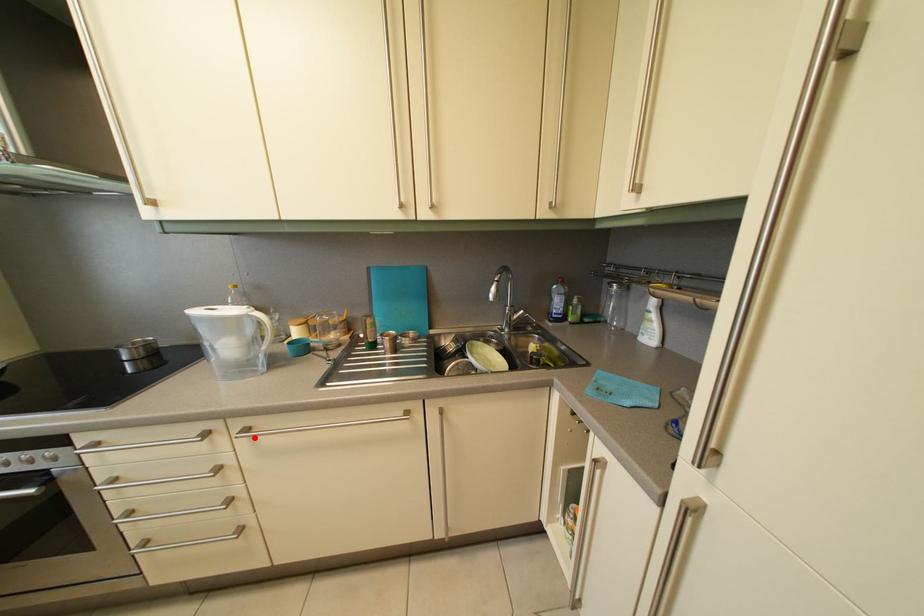
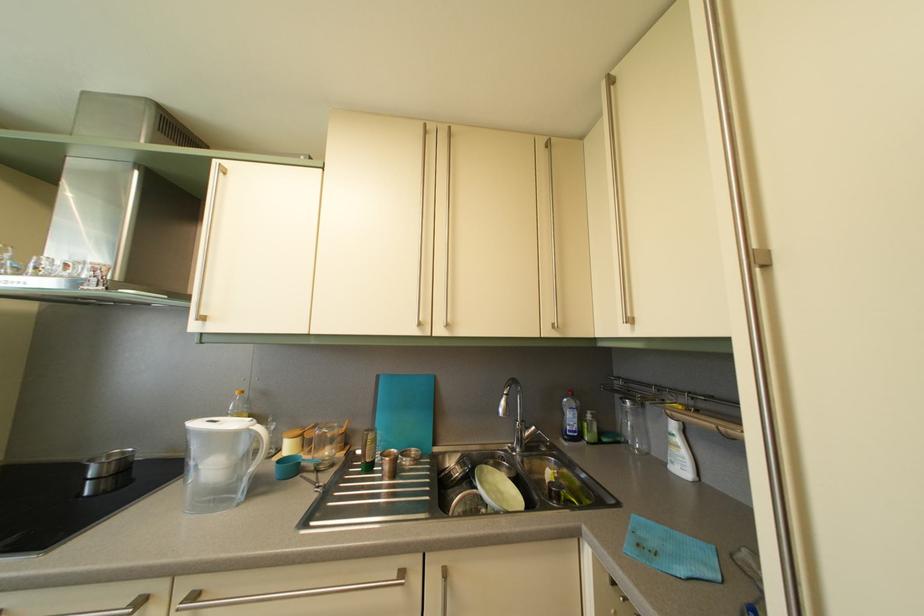
Locate, in the second image, the point that corresponds to the highlighted location in the first image.

(202, 604)